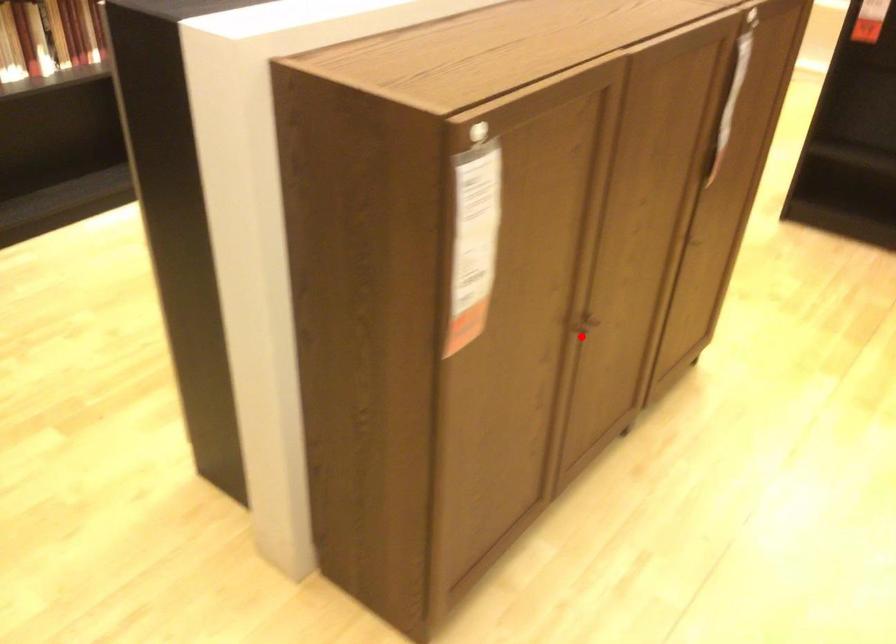
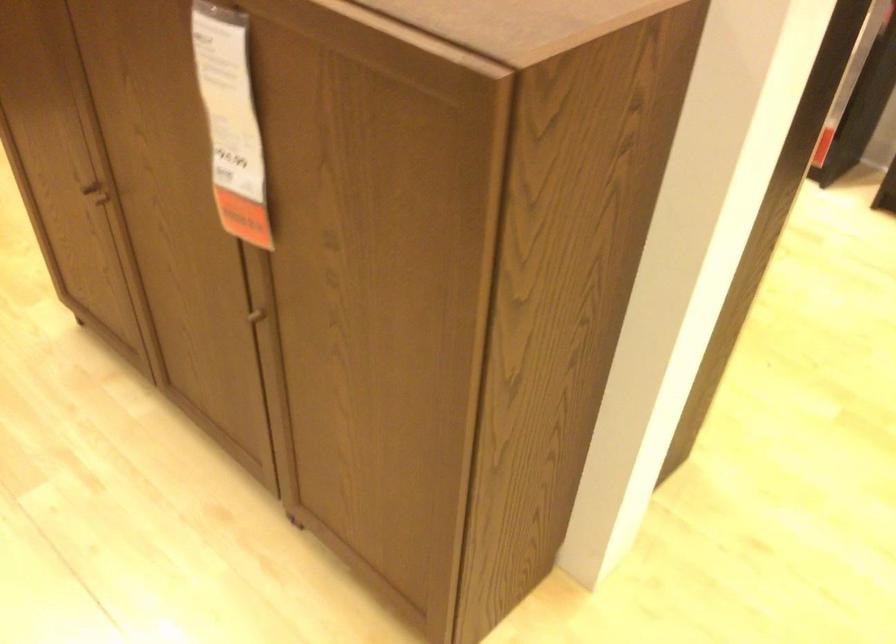
In the second image, find the point that corresponds to the highlighted location in the first image.

(95, 196)